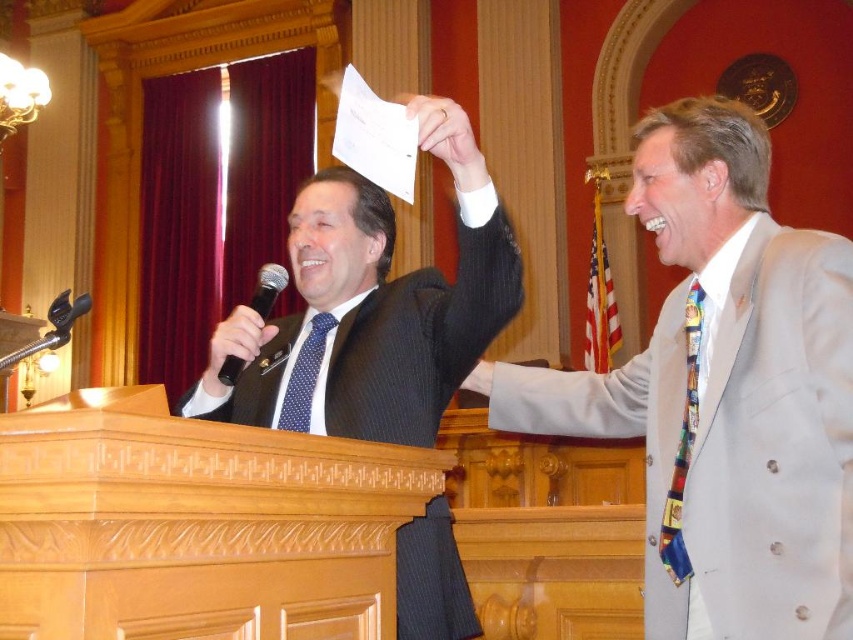
You are a photographer standing at the back of the chamber. You want to take a photo of the blue dotted tie at center and the black plastic microphone at left such that both are in focus. The camera can only focus on objects within a 20 inch range. Is this possible?

The blue dotted tie at center and black plastic microphone at left are 22.81 inches apart from each other. Since the distance between them exceeds the 20 inch focus range, it is not possible to have both in focus simultaneously.

You are a photographer standing in the center of the room. You want to take a photo that includes both point A at point (x=695, y=278) and point B at point (x=312, y=339). Which point should you position closer to the camera to ensure both points are in focus?

To ensure both points are in focus, position point A at point (x=695, y=278) closer to the camera since it is in front of point B at point (x=312, y=339). This way, the depth of field will cover both points effectively.

You are a fashion designer observing the two men in the formal setting. You need to determine which tie, the multicolored fabric tie at right or the blue dotted tie at center, is wider. Based on the description provided, which one is wider?

The multicolored fabric tie at right might be wider than blue dotted tie at center.